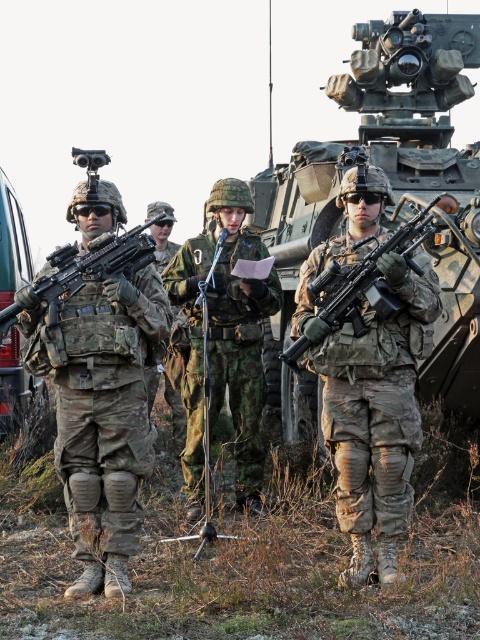
What do you see at coordinates (369, 378) in the screenshot? I see `camouflage fabric rifle at center` at bounding box center [369, 378].

Does camouflage fabric rifle at center have a lesser height compared to matte black rifle at left?

No, camouflage fabric rifle at center is not shorter than matte black rifle at left.

Find the location of a particular element. The height and width of the screenshot is (640, 480). camouflage fabric rifle at center is located at coordinates (369, 378).

Is camo fabric uniform at center bigger than matte black rifle at left?

Yes, camo fabric uniform at center is bigger than matte black rifle at left.

Measure the distance between point (259, 474) and camera.

Point (259, 474) and camera are 25.28 feet apart from each other.

Locate an element on the screen. The width and height of the screenshot is (480, 640). camo fabric uniform at center is located at coordinates (225, 340).

Can you confirm if camouflage fabric rifle at left is shorter than metallic green vehicle at left?

No, camouflage fabric rifle at left is not shorter than metallic green vehicle at left.

Is camouflage fabric rifle at left positioned in front of metallic green vehicle at left?

Yes.

Which is in front, point (32, 326) or point (0, 202)?

Point (32, 326) is in front.

Locate an element on the screen. camouflage fabric rifle at left is located at coordinates (101, 412).